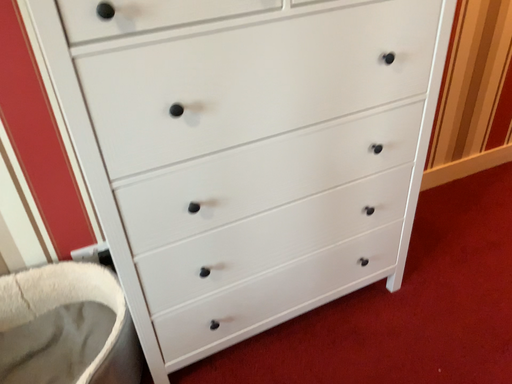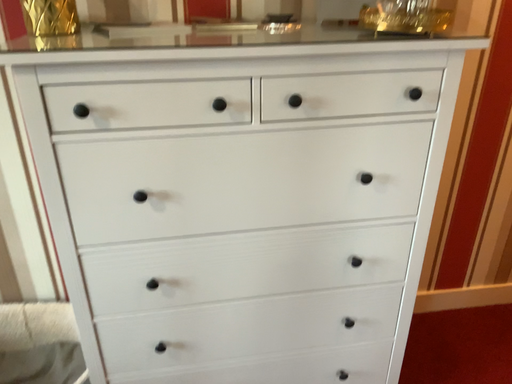
Question: Which way did the camera rotate in the video?

Choices:
 (A) rotated left
 (B) rotated right

Answer: (A)